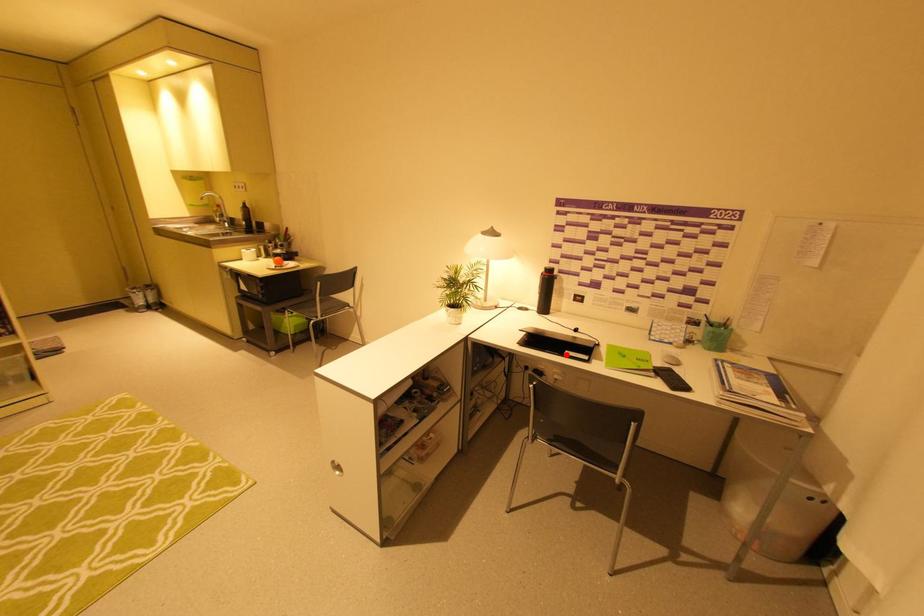
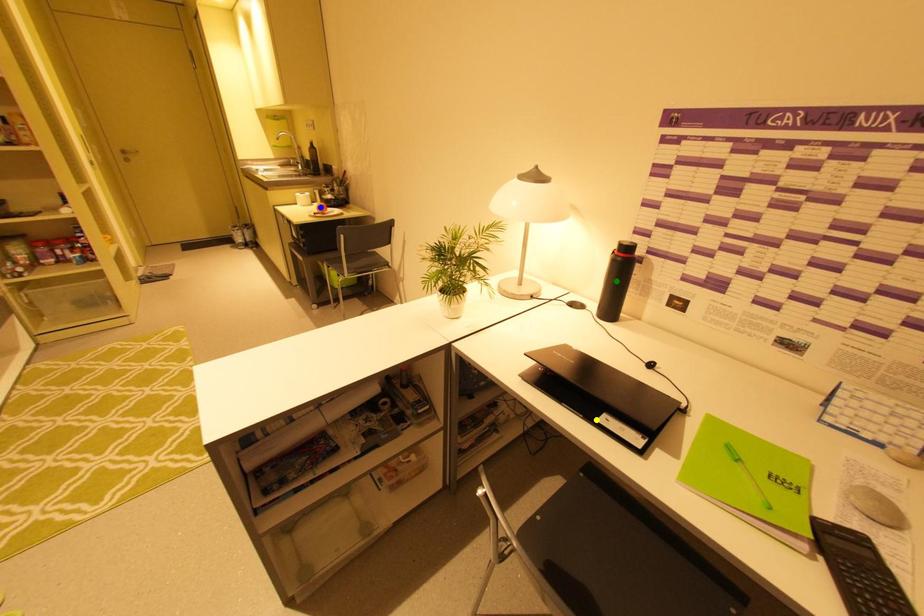
Question: I am providing you with two images of the same scene from different viewpoints. A red point is marked on the first image. You are given multiple points on the second image. Which spot in image 2 lines up with the point in image 1?

Choices:
 (A) yellow point
 (B) green point
 (C) blue point

Answer: (A)